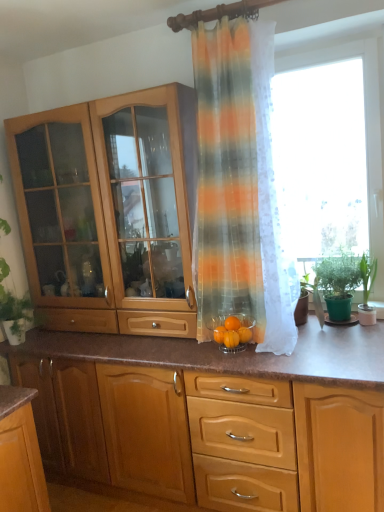
Question: Does transparent fabric at right have a greater height compared to translucent striped curtain at center?

Choices:
 (A) yes
 (B) no

Answer: (B)

Question: Is transparent fabric at right completely or partially outside of translucent striped curtain at center?

Choices:
 (A) yes
 (B) no

Answer: (A)

Question: Does transparent fabric at right have a larger size compared to translucent striped curtain at center?

Choices:
 (A) yes
 (B) no

Answer: (B)

Question: From the image's perspective, is transparent fabric at right on translucent striped curtain at center?

Choices:
 (A) yes
 (B) no

Answer: (A)

Question: Can you confirm if transparent fabric at right is positioned to the left of translucent striped curtain at center?

Choices:
 (A) no
 (B) yes

Answer: (A)

Question: Looking at their shapes, would you say wooden cabinet at center, the 1th cabinetry in the bottom-to-top sequence, is wider or thinner than transparent fabric at right?

Choices:
 (A) wide
 (B) thin

Answer: (A)

Question: From a real-world perspective, is wooden cabinet at center, the 1th cabinetry in the bottom-to-top sequence, above or below transparent fabric at right?

Choices:
 (A) below
 (B) above

Answer: (A)

Question: Visually, is wooden cabinet at center, which is the 2th cabinetry from top to bottom, positioned to the left or to the right of transparent fabric at right?

Choices:
 (A) right
 (B) left

Answer: (B)

Question: From the image's perspective, is wooden cabinet at center, the 1th cabinetry in the bottom-to-top sequence, located above or below transparent fabric at right?

Choices:
 (A) below
 (B) above

Answer: (A)

Question: From a real-world perspective, is green leafy plant at right, the 1th houseplant in the right-to-left sequence, positioned above or below translucent striped curtain at center?

Choices:
 (A) above
 (B) below

Answer: (B)

Question: Is green leafy plant at right, which is the 2th houseplant in left-to-right order, taller or shorter than translucent striped curtain at center?

Choices:
 (A) tall
 (B) short

Answer: (B)

Question: Visually, is green leafy plant at right, the 1th houseplant in the right-to-left sequence, positioned to the left or to the right of translucent striped curtain at center?

Choices:
 (A) right
 (B) left

Answer: (A)

Question: Relative to translucent striped curtain at center, is green leafy plant at right, which is the 2th houseplant in left-to-right order, in front or behind?

Choices:
 (A) behind
 (B) front

Answer: (A)

Question: Is green matte plant at right, which is the 2th houseplant from right to left, in front of or behind orange matte glass bowl at center, the first orange from the right, in the image?

Choices:
 (A) behind
 (B) front

Answer: (A)

Question: Would you say green matte plant at right, which is counted as the first houseplant, starting from the left, is to the left or to the right of orange matte glass bowl at center, the first orange from the right, in the picture?

Choices:
 (A) left
 (B) right

Answer: (B)